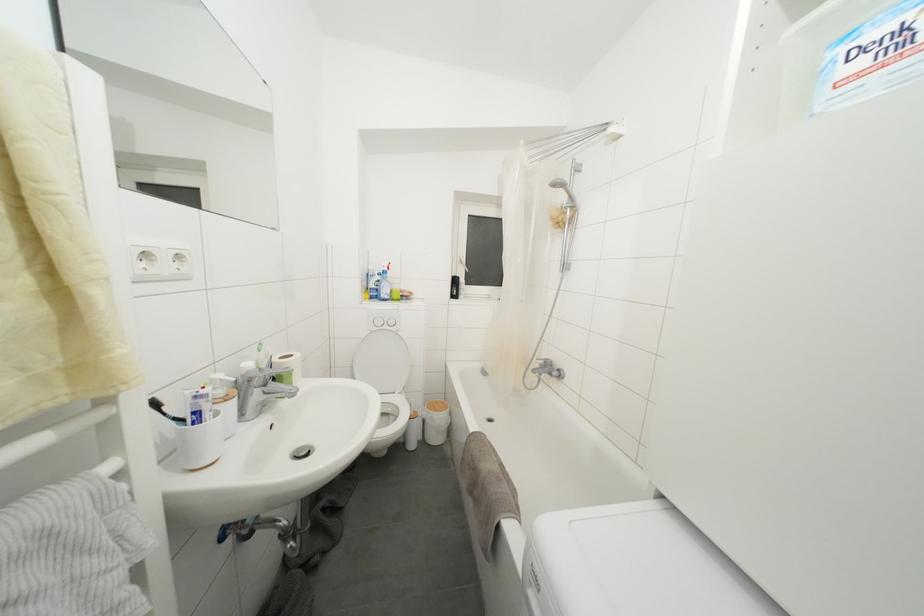
The height and width of the screenshot is (616, 924). Find the location of `white toilet lid`. white toilet lid is located at coordinates (382, 361).